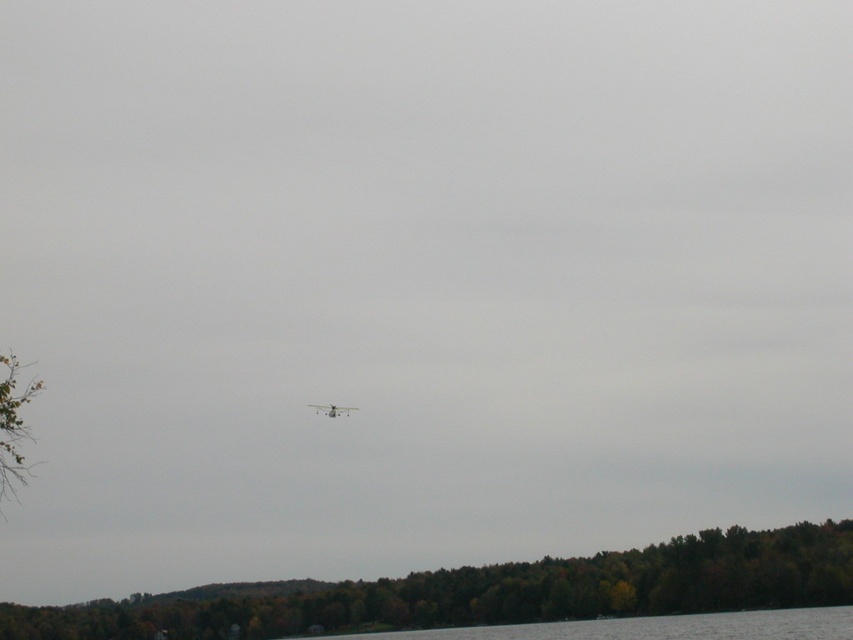
Question: Which object is positioned closest to the clear water at lower center?

Choices:
 (A) metallic silver airplane at center
 (B) green matte tree at lower center
 (C) green leafy tree at left

Answer: (B)

Question: Which point appears farthest from the camera in this image?

Choices:
 (A) coord(352,406)
 (B) coord(0,397)

Answer: (A)

Question: Is clear water at lower center wider than metallic silver airplane at center?

Choices:
 (A) no
 (B) yes

Answer: (B)

Question: Is clear water at lower center below green leafy tree at left?

Choices:
 (A) yes
 (B) no

Answer: (A)

Question: Is clear water at lower center above green leafy tree at left?

Choices:
 (A) yes
 (B) no

Answer: (B)

Question: Which of the following is the farthest from the observer?

Choices:
 (A) (477, 604)
 (B) (340, 413)
 (C) (610, 628)

Answer: (A)